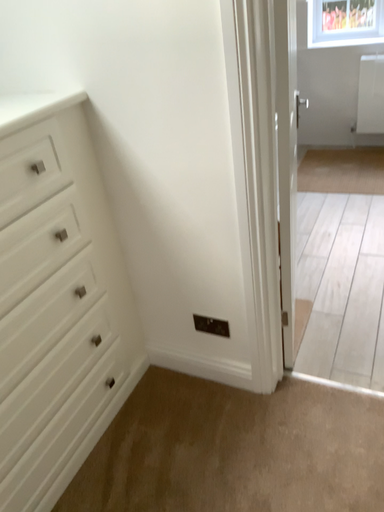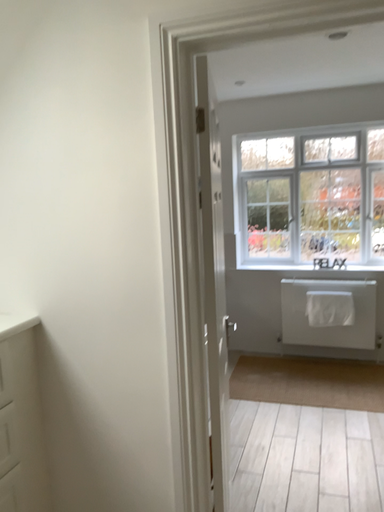
Question: Which way did the camera rotate in the video?

Choices:
 (A) rotated downward
 (B) rotated upward

Answer: (B)